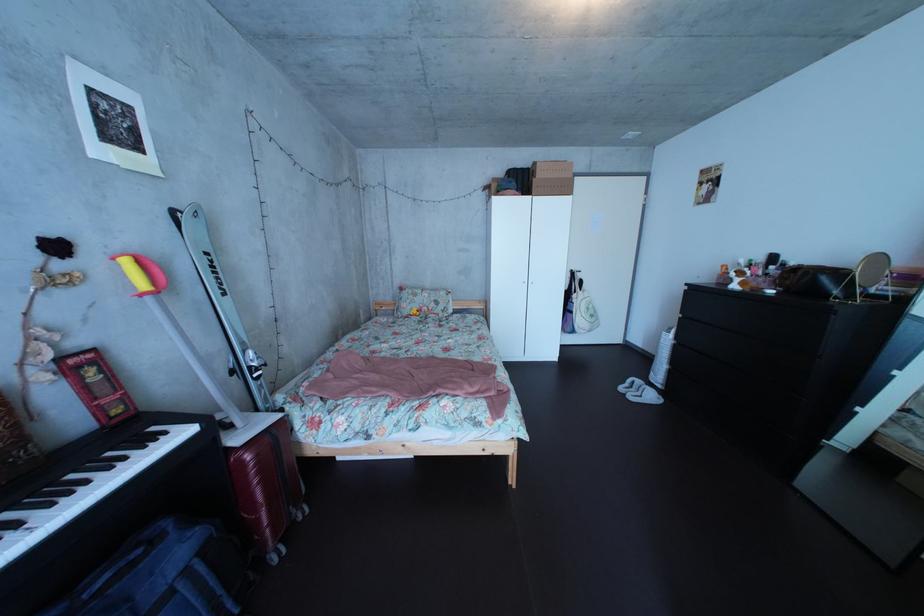
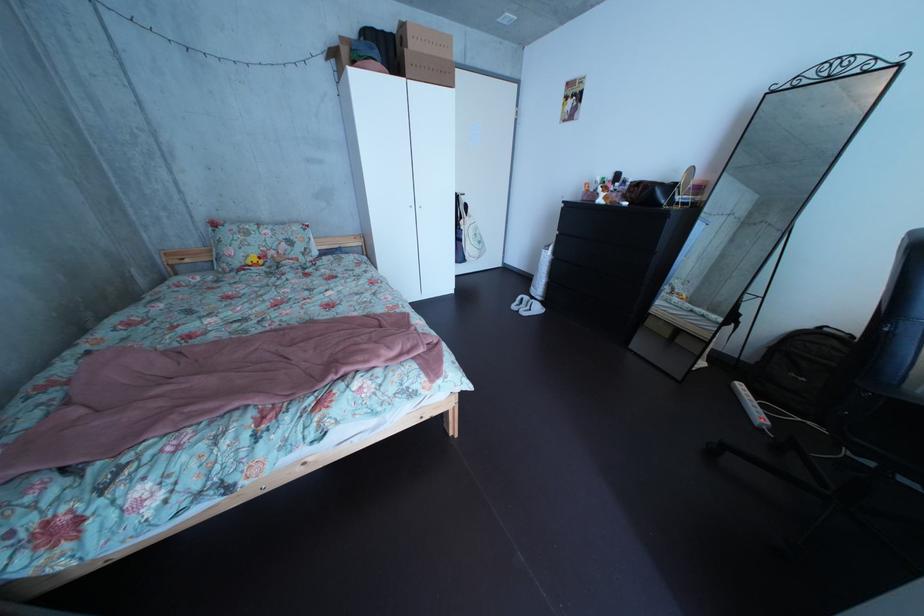
Locate, in the second image, the point that corresponds to [652,389] in the first image.

(541, 306)